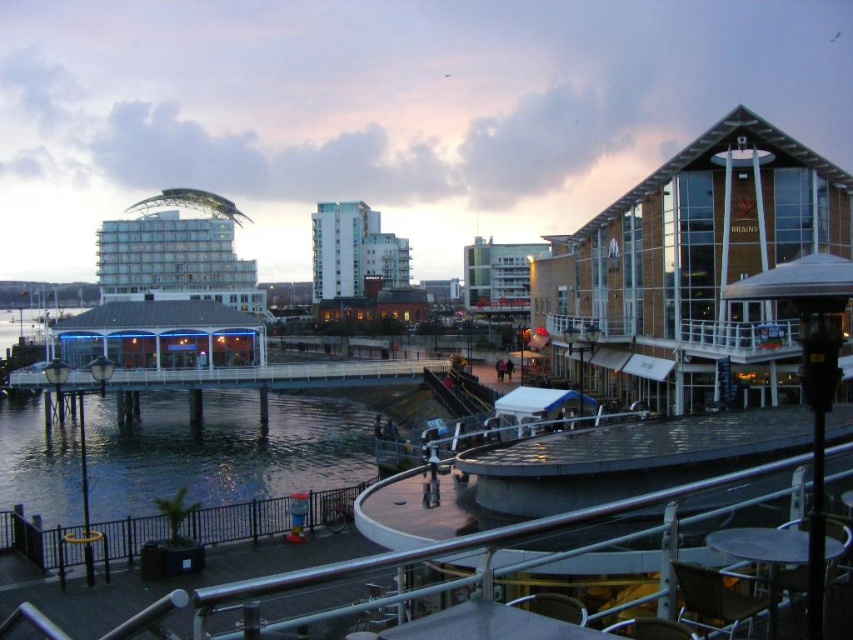
You are standing on the paved walkway and want to get to the clear water at lower left without crossing the black metal railing at lower left. Is there a path available to your left side that bypasses the railing?

The clear water at lower left is to the left of the black metal railing at lower left, so you can reach the clear water at lower left by moving to the left side past the black metal railing at lower left without crossing it.

You are standing on the black metal railing at lower left and want to see the clear water at lower left. Which direction should you look to see it?

The clear water at lower left is further to the viewer than the black metal railing at lower left, so you should look downward to see it.